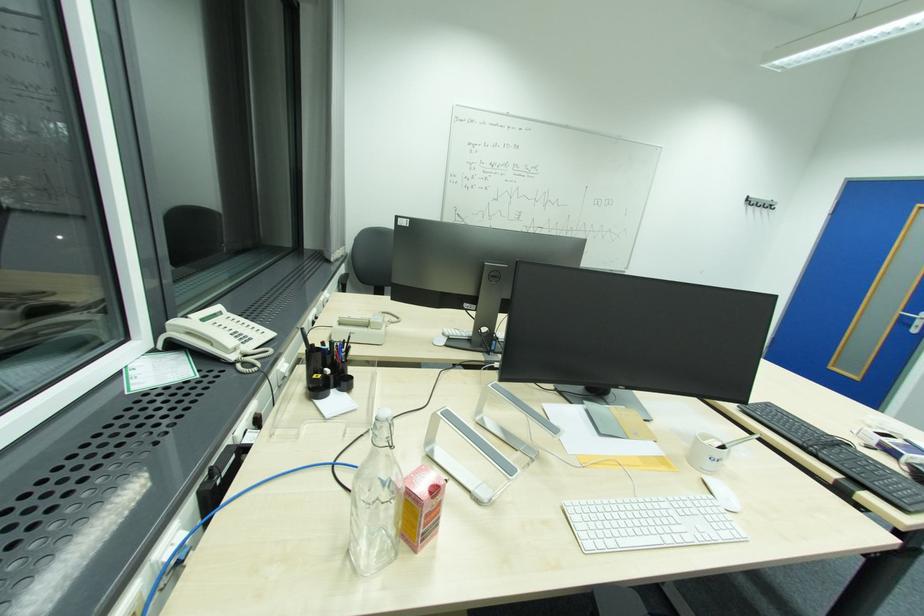
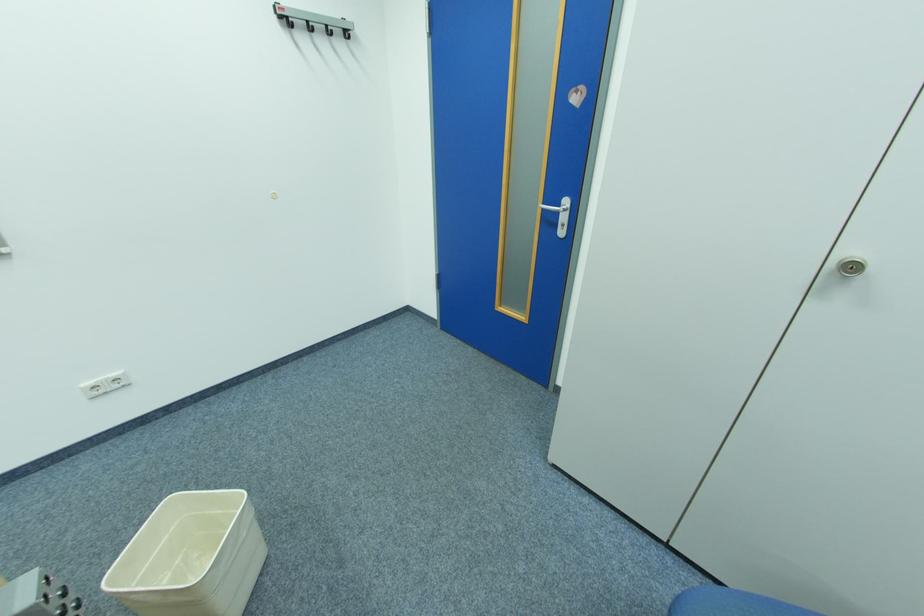
In the second image, find the point that corresponds to [755,204] in the first image.

(290, 25)